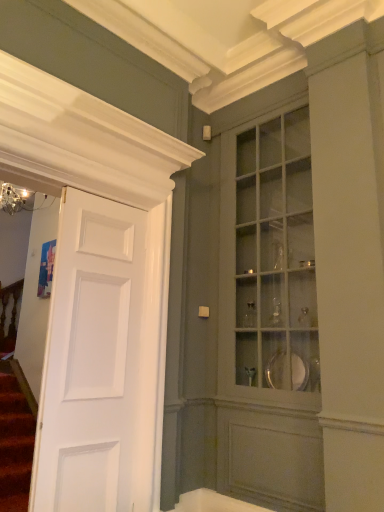
Question: Is white matte door at left taller than matte glass cabinet at center?

Choices:
 (A) no
 (B) yes

Answer: (A)

Question: Does white matte door at left have a smaller size compared to matte glass cabinet at center?

Choices:
 (A) no
 (B) yes

Answer: (B)

Question: From a real-world perspective, is white matte door at left on matte glass cabinet at center?

Choices:
 (A) no
 (B) yes

Answer: (A)

Question: Does white matte door at left appear on the left side of matte glass cabinet at center?

Choices:
 (A) yes
 (B) no

Answer: (A)

Question: Is white matte door at left facing away from matte glass cabinet at center?

Choices:
 (A) yes
 (B) no

Answer: (B)

Question: From a real-world perspective, is matte glass cabinet at center above or below white glossy bathtub at lower center?

Choices:
 (A) below
 (B) above

Answer: (B)

Question: From the image's perspective, is matte glass cabinet at center positioned above or below white glossy bathtub at lower center?

Choices:
 (A) above
 (B) below

Answer: (A)

Question: Is matte glass cabinet at center taller or shorter than white glossy bathtub at lower center?

Choices:
 (A) tall
 (B) short

Answer: (A)

Question: Is matte glass cabinet at center bigger or smaller than white glossy bathtub at lower center?

Choices:
 (A) small
 (B) big

Answer: (B)

Question: From the image's perspective, is white matte door at left above or below white glossy bathtub at lower center?

Choices:
 (A) above
 (B) below

Answer: (A)

Question: Is point (71, 445) positioned closer to the camera than point (215, 509)?

Choices:
 (A) closer
 (B) farther

Answer: (A)

Question: From a real-world perspective, is white matte door at left above or below white glossy bathtub at lower center?

Choices:
 (A) above
 (B) below

Answer: (A)

Question: In the image, is white matte door at left on the left side or the right side of white glossy bathtub at lower center?

Choices:
 (A) left
 (B) right

Answer: (A)

Question: Is white glossy bathtub at lower center bigger or smaller than matte glass cabinet at center?

Choices:
 (A) big
 (B) small

Answer: (B)

Question: Is white glossy bathtub at lower center in front of or behind matte glass cabinet at center in the image?

Choices:
 (A) behind
 (B) front

Answer: (A)